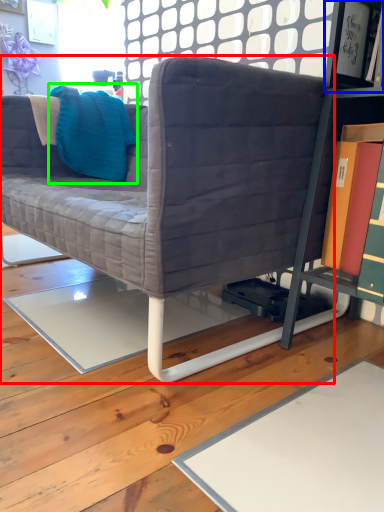
Question: Considering the real-world distances, which object is closest to studio couch (highlighted by a red box)? shelf (highlighted by a blue box) or throw pillow (highlighted by a green box).

Choices:
 (A) shelf
 (B) throw pillow

Answer: (B)